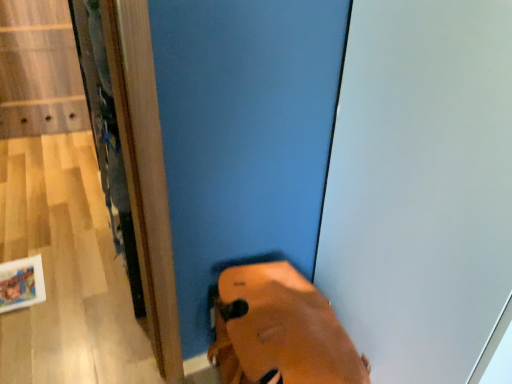
Question: Relative to leather shoe at lower center, is white glossy screen door at upper right in front or behind?

Choices:
 (A) behind
 (B) front

Answer: (B)

Question: Is white glossy screen door at upper right bigger or smaller than leather shoe at lower center?

Choices:
 (A) small
 (B) big

Answer: (B)

Question: From a real-world perspective, is white glossy screen door at upper right physically located above or below leather shoe at lower center?

Choices:
 (A) below
 (B) above

Answer: (B)

Question: Would you say leather shoe at lower center is to the left or to the right of white glossy screen door at upper right in the picture?

Choices:
 (A) right
 (B) left

Answer: (B)

Question: Is point (305, 354) positioned closer to the camera than point (417, 256)?

Choices:
 (A) farther
 (B) closer

Answer: (A)

Question: From the image's perspective, is leather shoe at lower center above or below white glossy screen door at upper right?

Choices:
 (A) below
 (B) above

Answer: (A)

Question: In terms of height, does leather shoe at lower center look taller or shorter compared to white glossy screen door at upper right?

Choices:
 (A) short
 (B) tall

Answer: (A)